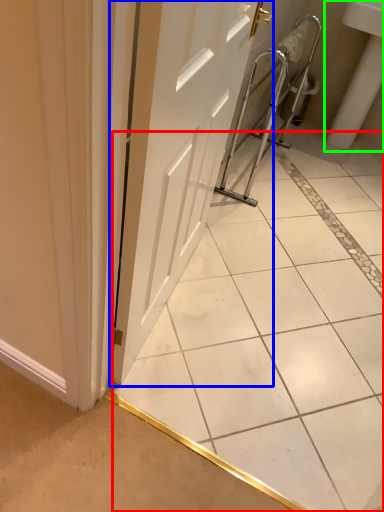
Question: Estimate the real-world distances between objects in this image. Which object is closer to ceramic tile (highlighted by a red box), door (highlighted by a blue box) or sink (highlighted by a green box)?

Choices:
 (A) door
 (B) sink

Answer: (A)